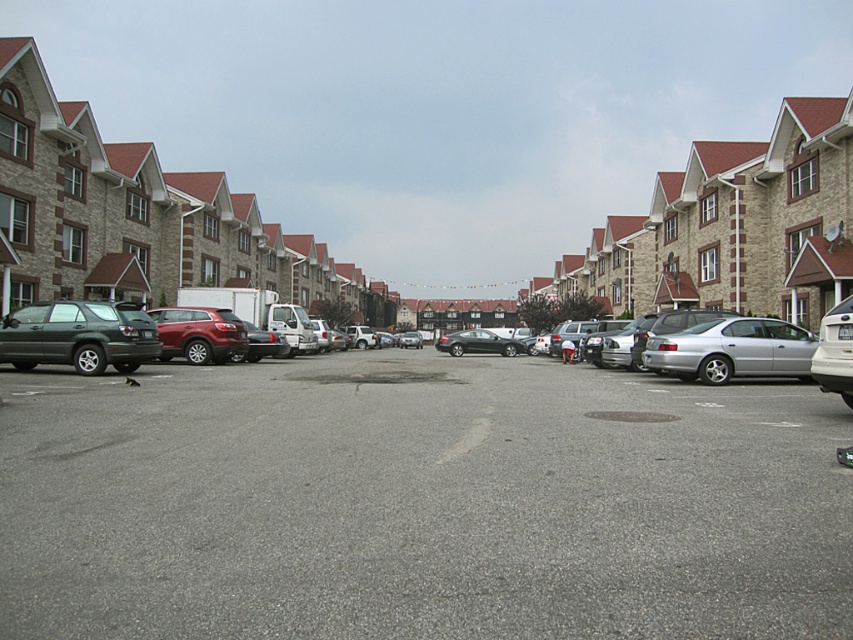
Based on the photo, is satin red suv at center above silver metallic sedan at right?

Correct, satin red suv at center is located above silver metallic sedan at right.

Does satin red suv at center have a lesser width compared to silver metallic sedan at right?

In fact, satin red suv at center might be wider than silver metallic sedan at right.

This screenshot has width=853, height=640. I want to click on satin red suv at center, so click(x=199, y=333).

Who is taller, silver metallic sedan at center-right or satin red suv at center?

With more height is satin red suv at center.

What do you see at coordinates (732, 349) in the screenshot?
I see `silver metallic sedan at center-right` at bounding box center [732, 349].

Who is more forward, (772, 352) or (206, 312)?

Point (772, 352)

Where is `silver metallic sedan at center-right`? silver metallic sedan at center-right is located at coordinates (732, 349).

Is satin silver sedan at center taller than silver metallic sedan at center?

No, satin silver sedan at center is not taller than silver metallic sedan at center.

Between satin silver sedan at center and silver metallic sedan at center, which one appears on the left side from the viewer's perspective?

silver metallic sedan at center

Does point (248, 356) lie in front of point (346, 340)?

Yes, it is in front of point (346, 340).

Locate an element on the screen. This screenshot has width=853, height=640. satin silver sedan at center is located at coordinates (264, 342).